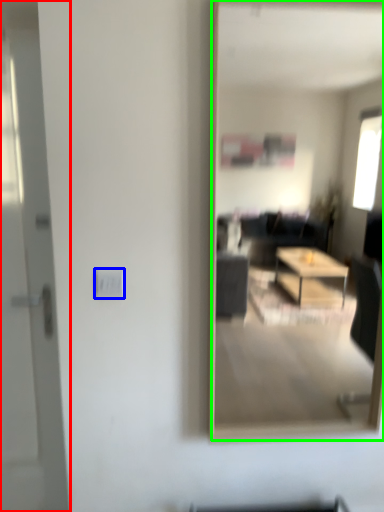
Question: Considering the real-world distances, which object is closest to door (highlighted by a red box)? electric outlet (highlighted by a blue box) or mirror (highlighted by a green box).

Choices:
 (A) electric outlet
 (B) mirror

Answer: (A)